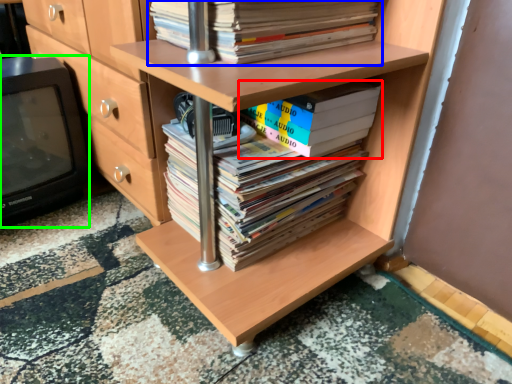
Question: Which object is the farthest from book (highlighted by a red box)? Choose among these: book (highlighted by a blue box) or wide (highlighted by a green box).

Choices:
 (A) book
 (B) wide

Answer: (B)